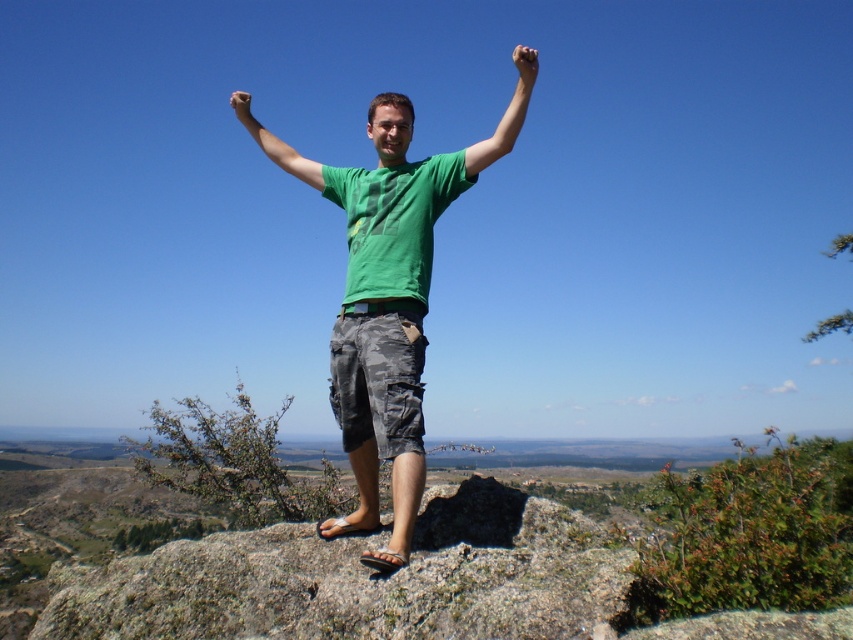
You are a photographer trying to capture the person standing on the rocky outcrop. You need to focus your camera on the green matte shirt at center located at point (286,156). What is the exact coordinate where you should aim your camera?

The green matte shirt at center is located at point (286,156), so you should aim your camera at that coordinate.